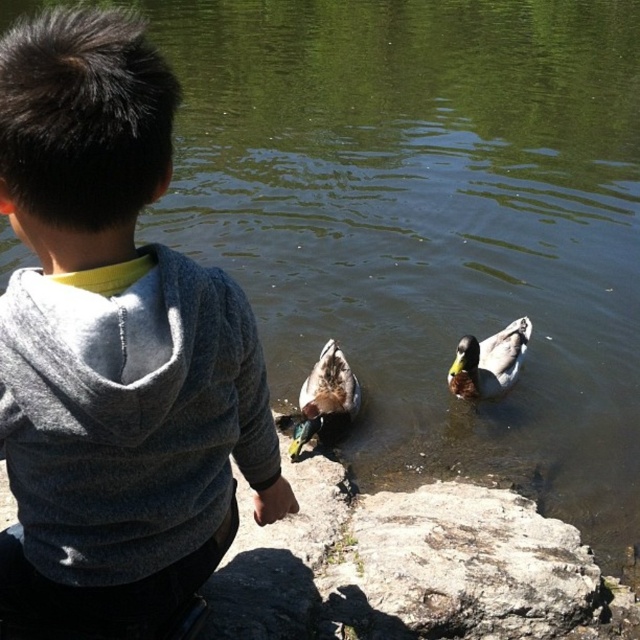
Who is shorter, gray hoodie at center or green glossy duck at center?

Standing shorter between the two is green glossy duck at center.

Between gray hoodie at center and green glossy duck at center, which one is positioned higher?

Positioned higher is gray hoodie at center.

Find the location of a particular element. This screenshot has width=640, height=640. gray hoodie at center is located at coordinates (113, 349).

Between gray hoodie at center and gray rough rock at center, which one has less height?

gray rough rock at center

Can you confirm if gray hoodie at center is thinner than gray rough rock at center?

Indeed, gray hoodie at center has a lesser width compared to gray rough rock at center.

This screenshot has height=640, width=640. Find the location of `gray hoodie at center`. gray hoodie at center is located at coordinates (113, 349).

Is point (378, 600) more distant than point (481, 349)?

No, (378, 600) is closer to viewer.

Can you confirm if gray rough rock at center is positioned to the right of greenish-gray feathers duck at right?

In fact, gray rough rock at center is to the left of greenish-gray feathers duck at right.

What do you see at coordinates (458, 566) in the screenshot? The image size is (640, 640). I see `gray rough rock at center` at bounding box center [458, 566].

Identify the location of gray rough rock at center. (458, 566).